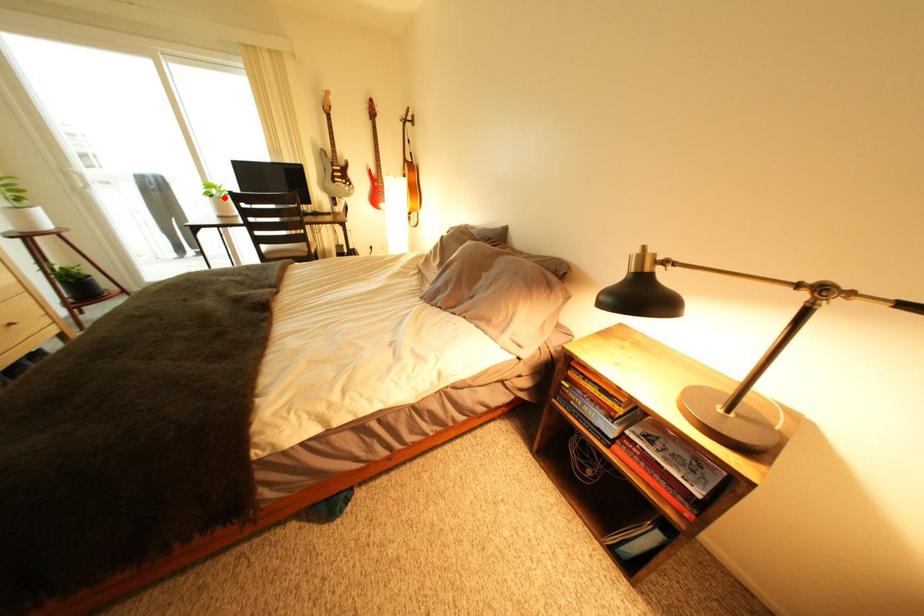
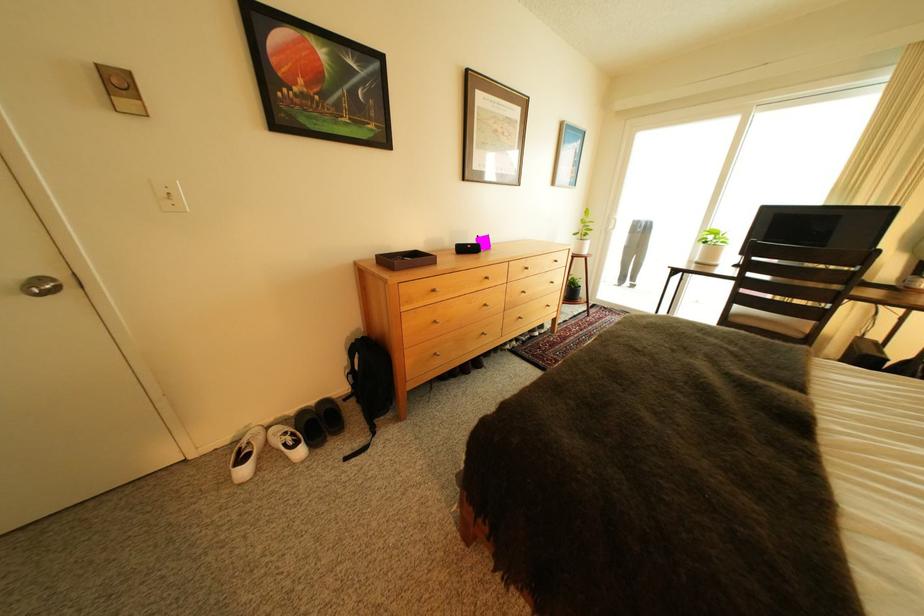
In the second image, find the point that corresponds to the highlighted location in the first image.

(718, 244)